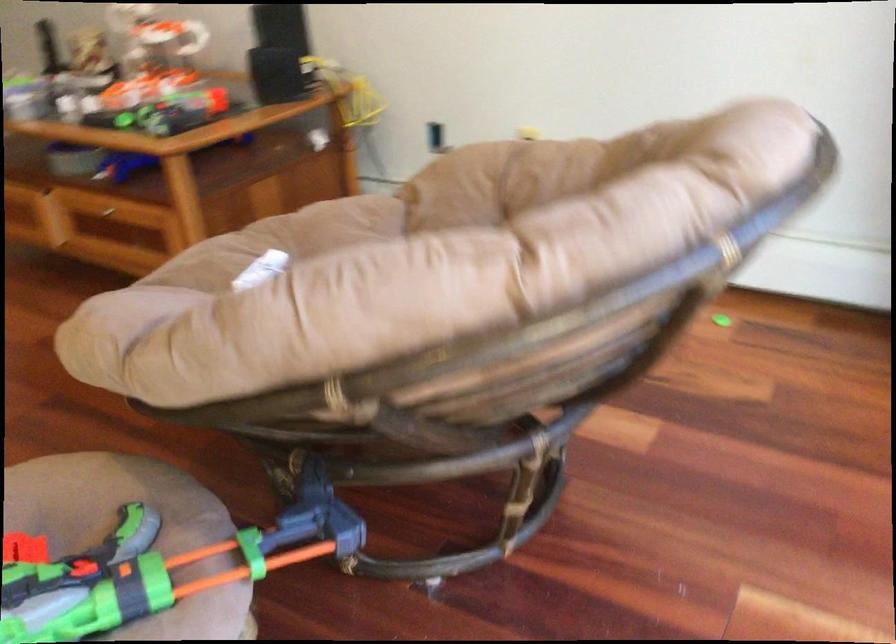
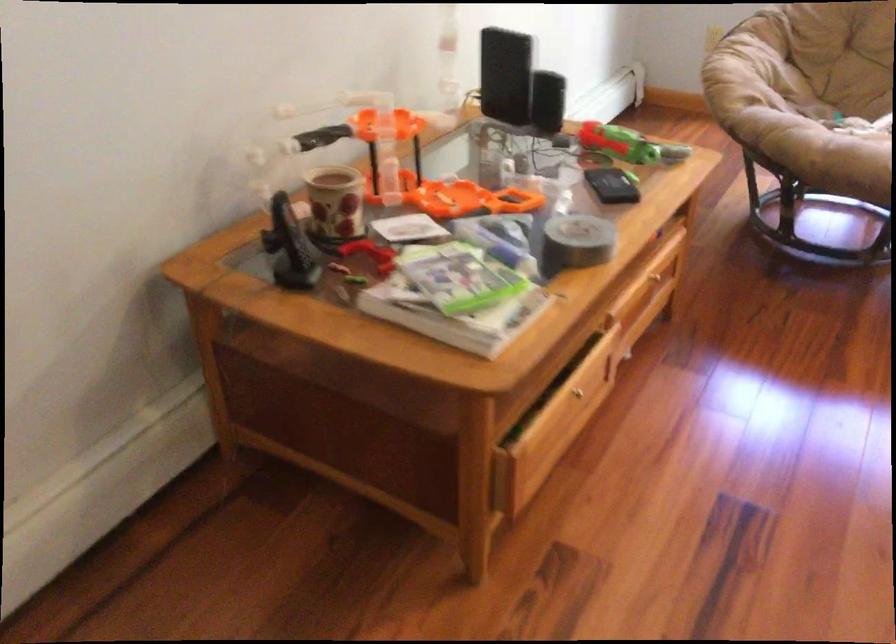
Locate, in the second image, the point that corresponds to the point at 138,93 in the first image.

(470, 199)